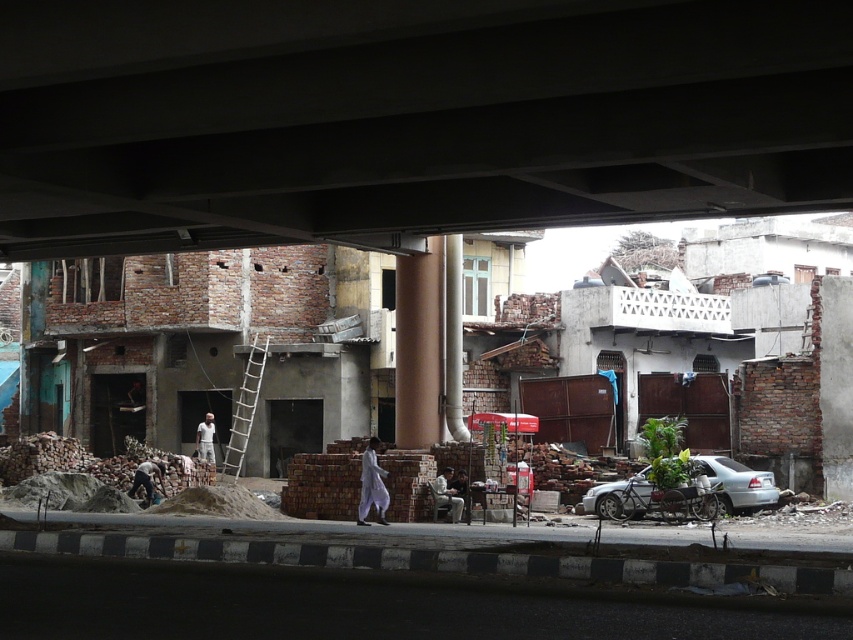
Who is more forward, (229,480) or (206,452)?

Positioned in front is point (206,452).

Does point (219, 477) come in front of point (206, 433)?

Yes, point (219, 477) is closer to viewer.

Is point (231, 449) positioned before point (207, 416)?

That is False.

At what (x,y) coordinates should I click in order to perform the action: click on white wooden ladder at center. Please return your answer as a coordinate pair (x, y). Looking at the image, I should click on (244, 410).

Find the location of `dark gray concrete overpass at upper center`. dark gray concrete overpass at upper center is located at coordinates (409, 116).

Which is more to the left, dark gray concrete overpass at upper center or silver metallic car at lower right?

dark gray concrete overpass at upper center

Locate an element on the screen. This screenshot has width=853, height=640. dark gray concrete overpass at upper center is located at coordinates (409, 116).

Does light brown fabric shirt at center have a greater height compared to white cotton shirt at center?

Incorrect, light brown fabric shirt at center's height is not larger of white cotton shirt at center's.

Which is below, light brown fabric shirt at center or white cotton shirt at center?

Positioned lower is white cotton shirt at center.

The image size is (853, 640). Find the location of `light brown fabric shirt at center`. light brown fabric shirt at center is located at coordinates (447, 493).